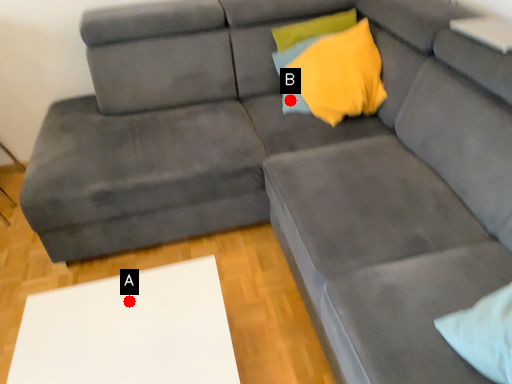
Question: Two points are circled on the image, labeled by A and B beside each circle. Which point is closer to the camera?

Choices:
 (A) A is closer
 (B) B is closer

Answer: (A)